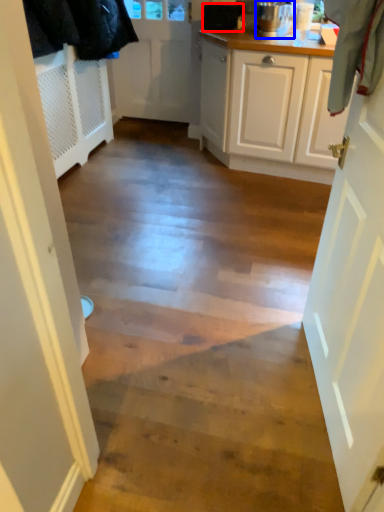
Question: Which of the following is the closest to the observer, appliance (highlighted by a red box) or kitchen appliance (highlighted by a blue box)?

Choices:
 (A) appliance
 (B) kitchen appliance

Answer: (B)